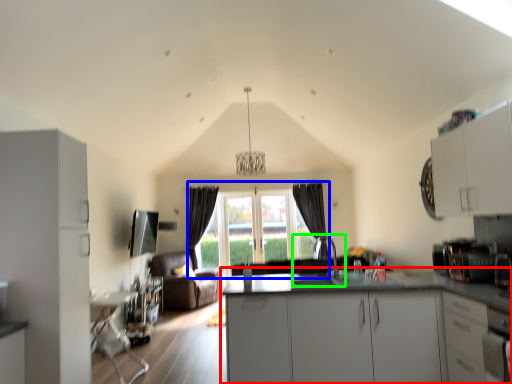
Question: Based on their relative distances, which object is nearer to countertop (highlighted by a red box)? Choose from window (highlighted by a blue box) and sink (highlighted by a green box).

Choices:
 (A) window
 (B) sink

Answer: (B)